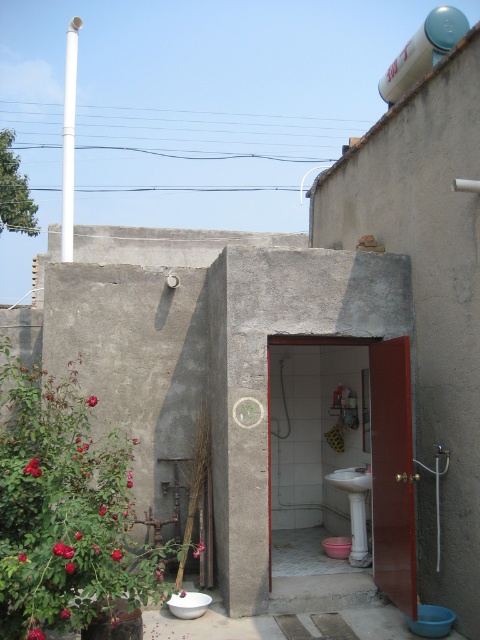
Question: Is white glossy water tank at upper right thinner than white glossy toilet bowl at center?

Choices:
 (A) yes
 (B) no

Answer: (B)

Question: Is matte concrete door at center wider than white glossy water tank at upper right?

Choices:
 (A) no
 (B) yes

Answer: (A)

Question: Which point appears closest to the camera in this image?

Choices:
 (A) (357, 474)
 (B) (331, 554)
 (C) (398, 97)
 (D) (439, 150)

Answer: (D)

Question: Is concrete wall at center to the right of blue plastic toilet bowl at lower right from the viewer's perspective?

Choices:
 (A) no
 (B) yes

Answer: (A)

Question: Which object is farther from the camera taking this photo?

Choices:
 (A) blue plastic toilet bowl at lower right
 (B) white glossy toilet bowl at center
 (C) white glossy water tank at upper right

Answer: (C)

Question: Among these objects, which one is farthest from the camera?

Choices:
 (A) concrete wall at center
 (B) white glossy toilet bowl at lower center
 (C) white glossy toilet bowl at center

Answer: (B)